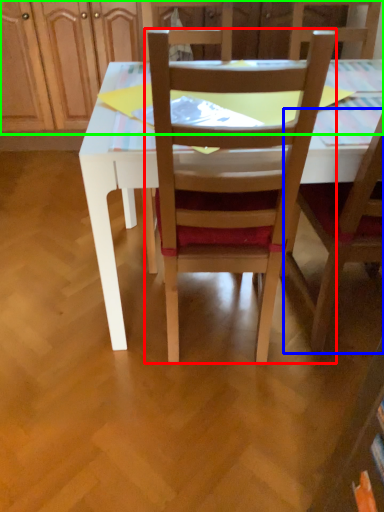
Question: Estimate the real-world distances between objects in this image. Which object is closer to chair (highlighted by a red box), chair (highlighted by a blue box) or dresser (highlighted by a green box)?

Choices:
 (A) chair
 (B) dresser

Answer: (A)